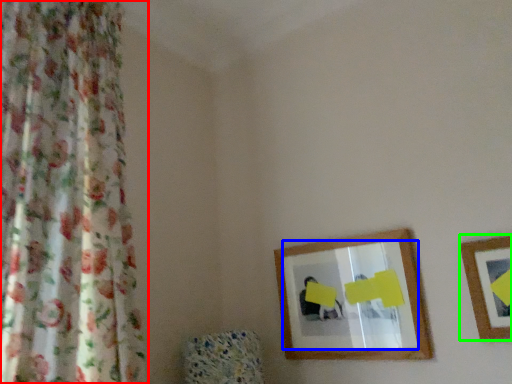
Question: Considering the real-world distances, which object is farthest from curtain (highlighted by a red box)? mirror (highlighted by a blue box) or picture frame (highlighted by a green box)?

Choices:
 (A) mirror
 (B) picture frame

Answer: (B)